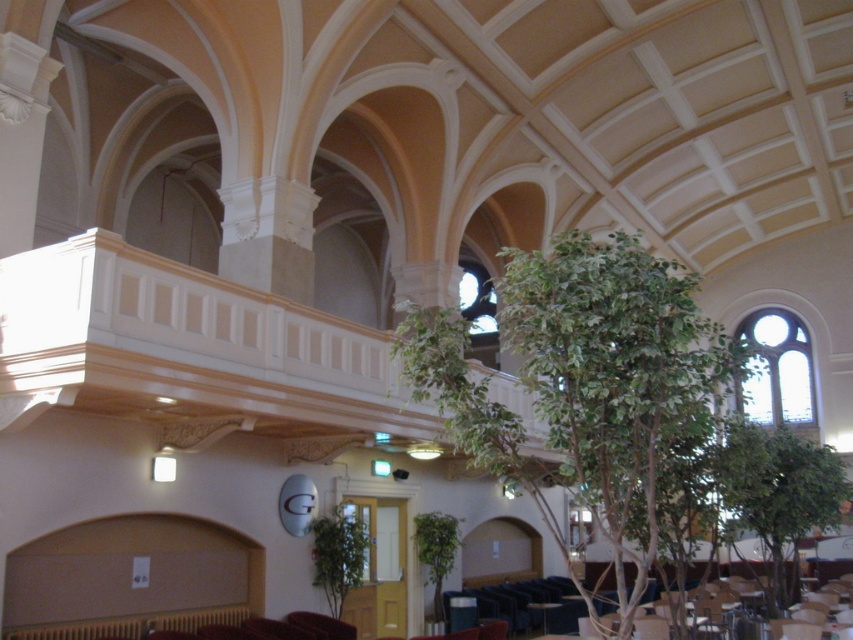
Question: Which point is farther to the camera?

Choices:
 (A) (403, 324)
 (B) (735, 493)

Answer: (B)

Question: Does green leafy tree at center appear over green leafy tree at lower right?

Choices:
 (A) no
 (B) yes

Answer: (B)

Question: Which point is farther to the camera?

Choices:
 (A) green leafy tree at center
 (B) green leafy tree at lower right

Answer: (B)

Question: Which point appears farthest from the camera in this image?

Choices:
 (A) (532, 365)
 (B) (733, 490)

Answer: (B)

Question: Can you confirm if green leafy tree at center is wider than green leafy tree at lower right?

Choices:
 (A) no
 (B) yes

Answer: (B)

Question: Observing the image, what is the correct spatial positioning of green leafy tree at center in reference to green leafy tree at lower right?

Choices:
 (A) below
 (B) above

Answer: (B)